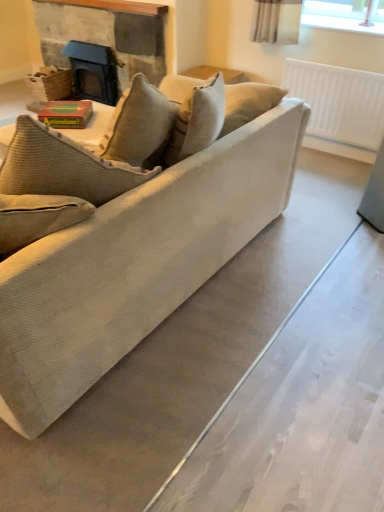
Question: Is matte black fireplace at upper left facing towards yellow-green cardboard book at center?

Choices:
 (A) no
 (B) yes

Answer: (B)

Question: Is matte black fireplace at upper left in front of yellow-green cardboard book at center?

Choices:
 (A) yes
 (B) no

Answer: (B)

Question: Can you confirm if matte black fireplace at upper left is bigger than yellow-green cardboard book at center?

Choices:
 (A) no
 (B) yes

Answer: (B)

Question: Can you confirm if matte black fireplace at upper left is shorter than yellow-green cardboard book at center?

Choices:
 (A) no
 (B) yes

Answer: (A)

Question: Is matte black fireplace at upper left oriented away from yellow-green cardboard book at center?

Choices:
 (A) yes
 (B) no

Answer: (B)

Question: From a real-world perspective, is matte black fireplace at upper left under yellow-green cardboard book at center?

Choices:
 (A) no
 (B) yes

Answer: (B)

Question: Can you confirm if white plastic radiator at upper right is taller than beige corduroy couch at center?

Choices:
 (A) no
 (B) yes

Answer: (A)

Question: From the image's perspective, is white plastic radiator at upper right below beige corduroy couch at center?

Choices:
 (A) yes
 (B) no

Answer: (B)

Question: Does white plastic radiator at upper right lie behind beige corduroy couch at center?

Choices:
 (A) yes
 (B) no

Answer: (A)

Question: Is white plastic radiator at upper right at the left side of beige corduroy couch at center?

Choices:
 (A) no
 (B) yes

Answer: (A)

Question: Is the depth of white plastic radiator at upper right less than that of beige corduroy couch at center?

Choices:
 (A) no
 (B) yes

Answer: (A)

Question: Does white plastic radiator at upper right have a smaller size compared to beige corduroy couch at center?

Choices:
 (A) yes
 (B) no

Answer: (A)

Question: From the image's perspective, would you say white plastic radiator at upper right is shown under yellow-green cardboard book at center?

Choices:
 (A) yes
 (B) no

Answer: (B)